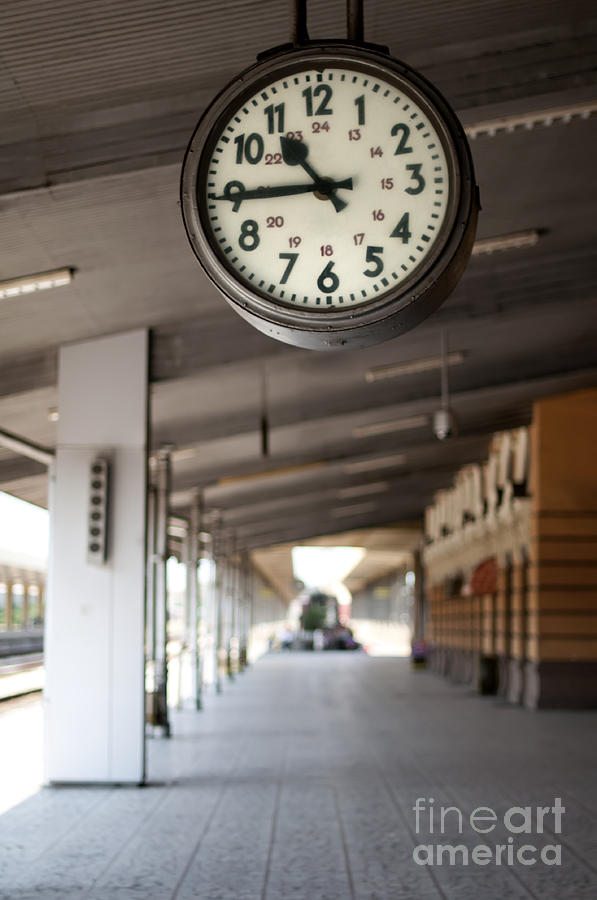
Identify the location of ceiling. This screenshot has width=597, height=900. (107, 255).